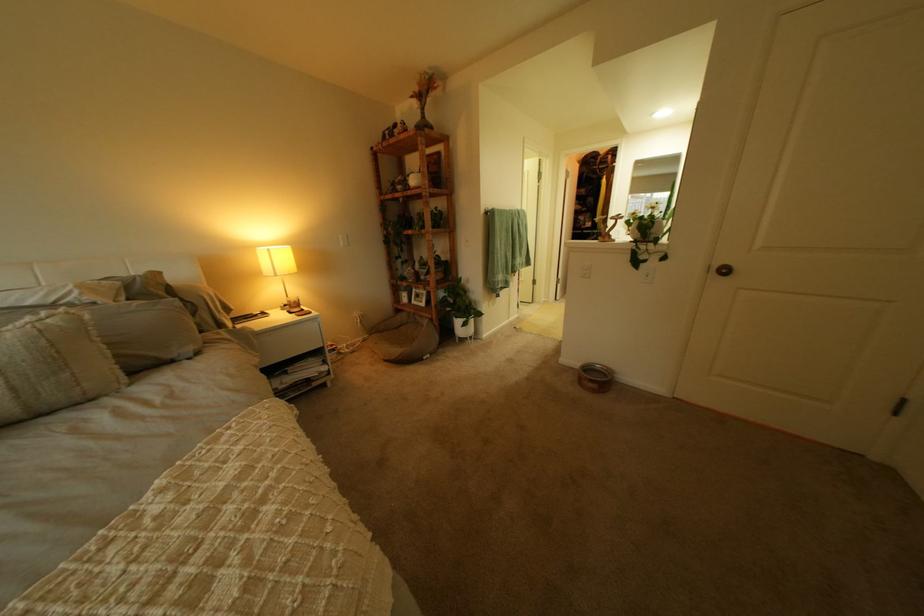
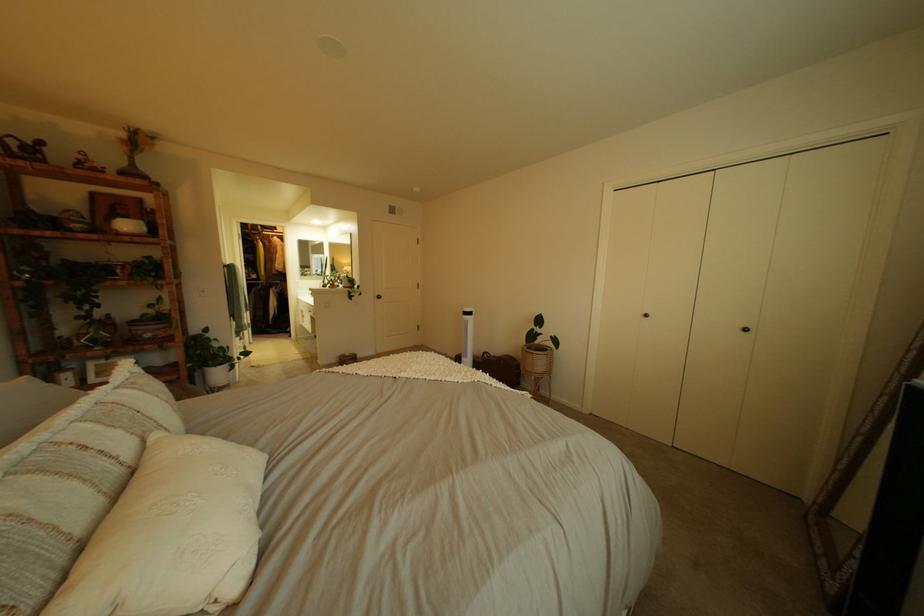
Where in the second image is the point corresponding to the point at 445,317 from the first image?

(189, 379)